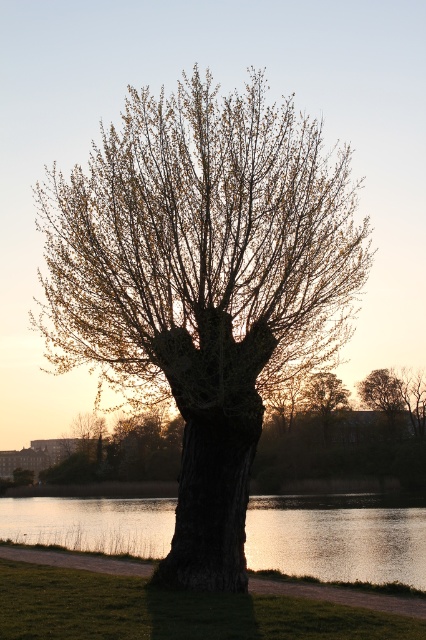
You are standing in a park and see the smooth bark tree at center. If you want to take a photo of it from a distance of exactly 50 feet, should you move closer or farther away?

The smooth bark tree at center is currently 42.31 feet away from you. To reach a distance of 50 feet, you need to move farther away from the tree.

You are a photographer setting up a shot of the smooth bark tree at center and the glistening water at tree right. The scene is during golden hour. Which object will receive more direct sunlight based on their positions?

The smooth bark tree at center is positioned over glistening water at tree right, so the tree will receive more direct sunlight than the water below it.